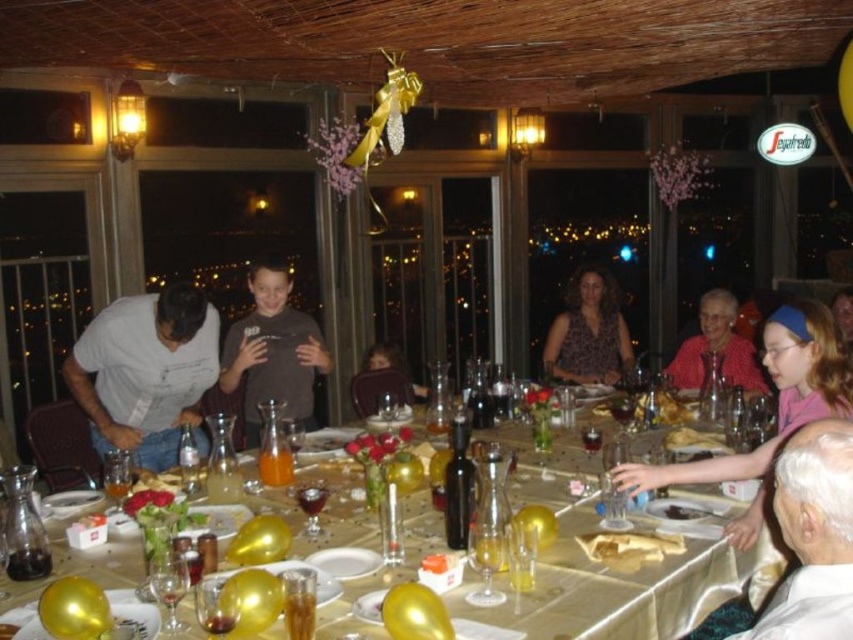
Does pink fabric headband at upper right have a larger size compared to matte brown shirt at center?

No.

You are a GUI agent. You are given a task and a screenshot of the screen. Output one action in this format:
    pyautogui.click(x=<x>, y=<y>)
    Task: Click on the pink fabric headband at upper right
    This screenshot has height=640, width=853.
    Given the screenshot: What is the action you would take?
    pyautogui.click(x=778, y=397)

Can you confirm if white satin headscarf at upper right is shorter than pink fabric headband at upper right?

Yes.

This screenshot has height=640, width=853. Find the location of `white satin headscarf at upper right`. white satin headscarf at upper right is located at coordinates (811, 536).

You are a GUI agent. You are given a task and a screenshot of the screen. Output one action in this format:
    pyautogui.click(x=<x>, y=<y>)
    Task: Click on the white satin headscarf at upper right
    The height and width of the screenshot is (640, 853).
    Given the screenshot: What is the action you would take?
    pyautogui.click(x=811, y=536)

Between gold satin tablecloth at center and matte gray shirt at left, which one has less height?

Standing shorter between the two is gold satin tablecloth at center.

Who is more distant from viewer, [550,557] or [149,372]?

Point [149,372]

I want to click on gold satin tablecloth at center, so click(x=616, y=582).